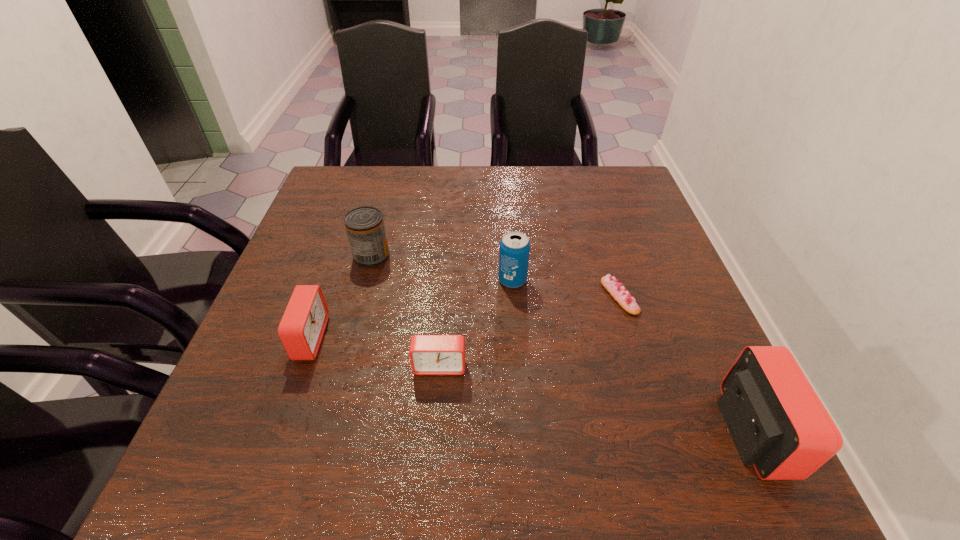
Identify the location of blank region between the eclair and the soda can. (566, 288).

The width and height of the screenshot is (960, 540). I want to click on vacant region between the second shortest object and the third object from right to left, so click(x=476, y=323).

Where is `free area in between the leftmost alarm clock and the fourth object from right to left`? free area in between the leftmost alarm clock and the fourth object from right to left is located at coordinates (374, 352).

Identify the location of vacant space that is in between the nearest alarm clock and the third object from left to right. (595, 399).

This screenshot has height=540, width=960. I want to click on vacant area that lies between the eclair and the fourth object from left to right, so click(566, 288).

Where is `vacant area that lies between the rightmost object and the third object from left to right`? The image size is (960, 540). vacant area that lies between the rightmost object and the third object from left to right is located at coordinates (595, 399).

Image resolution: width=960 pixels, height=540 pixels. I want to click on unoccupied position between the second object from right to left and the rightmost object, so click(x=685, y=364).

At what (x,y) coordinates should I click in order to perform the action: click on object that is the third closest to the third object from right to left. Please return your answer as a coordinate pair (x, y). Image resolution: width=960 pixels, height=540 pixels. Looking at the image, I should click on (365, 227).

Where is `the fourth closest object to the eclair`? This screenshot has height=540, width=960. the fourth closest object to the eclair is located at coordinates (365, 227).

The width and height of the screenshot is (960, 540). Identify the location of the third closest alarm clock relative to the second object from left to right. (778, 424).